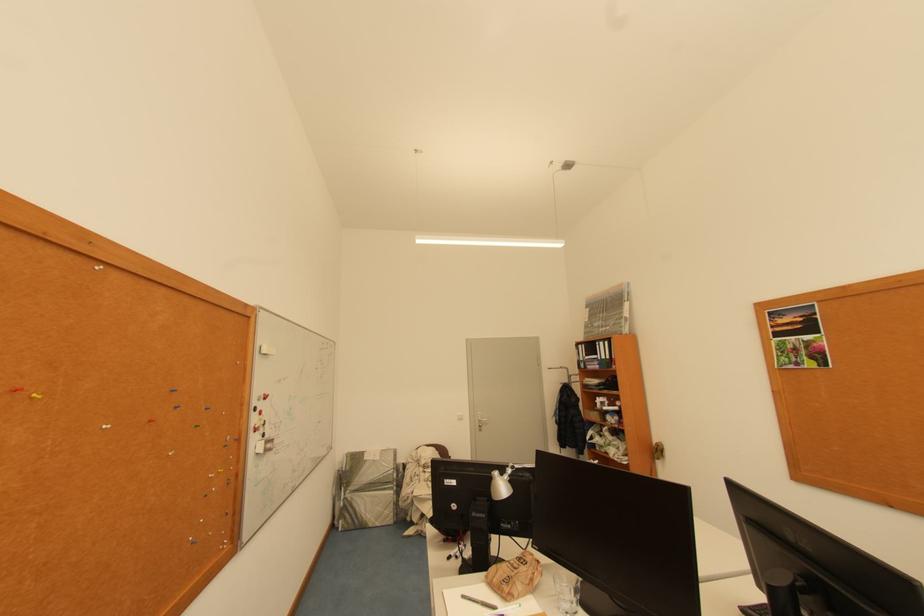
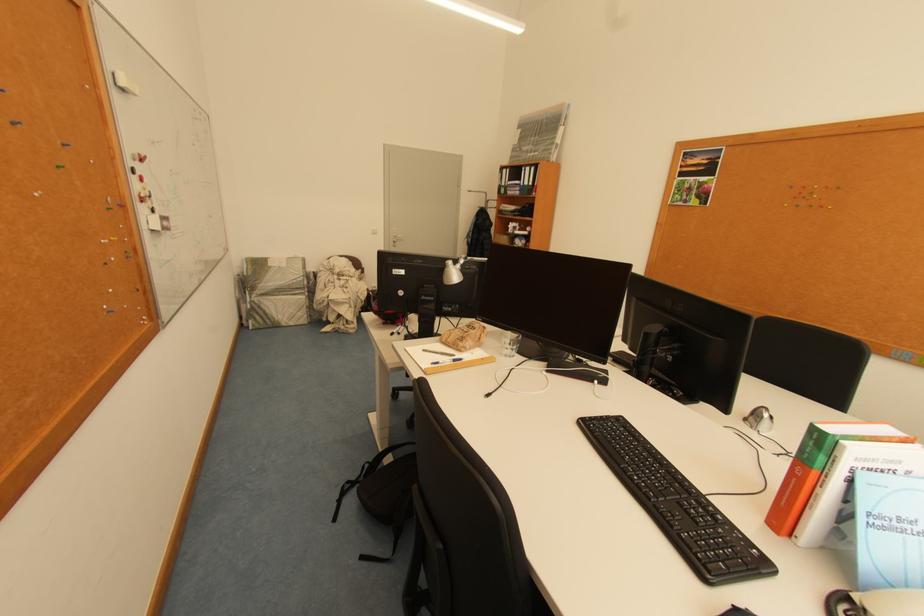
Find the pixel in the second image that matches point (488, 427) in the first image.

(402, 243)